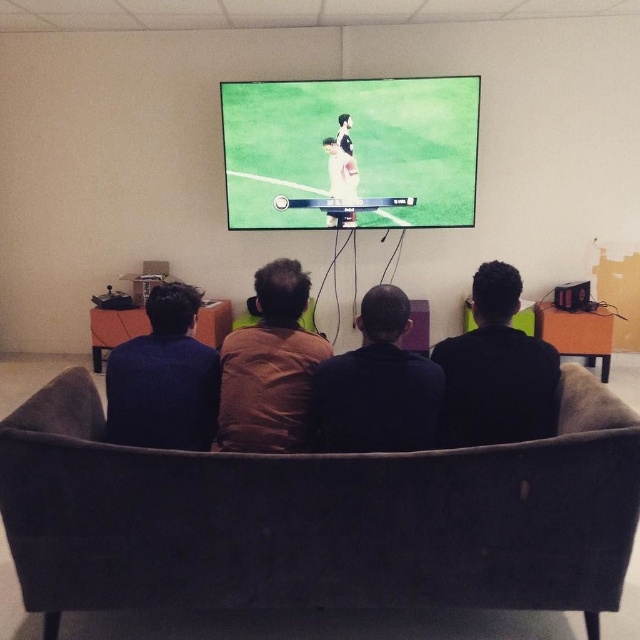
You are a photographer taking a picture of the black matte shirt at center and the dark brown sweater at center. Which one will appear larger in the photo?

The black matte shirt at center will appear larger in the photo because it is closer to the viewer than the dark brown sweater at center.

Looking at the two people sitting on the sofa, which one is wearing the black matte shirt at center and located to the right of the dark brown sweater at center?

The black matte shirt at center is to the right of the dark brown sweater at center.